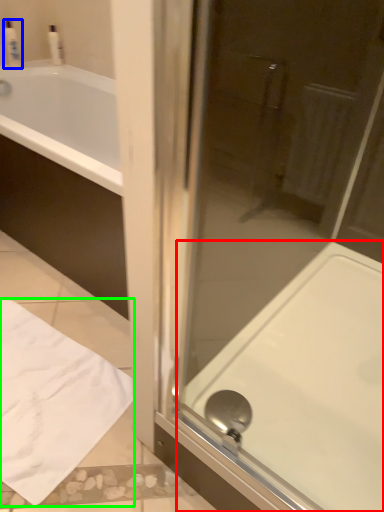
Question: Which object is positioned farthest from bath (highlighted by a red box)? Select from toiletry (highlighted by a blue box) and sheet (highlighted by a green box).

Choices:
 (A) toiletry
 (B) sheet

Answer: (A)